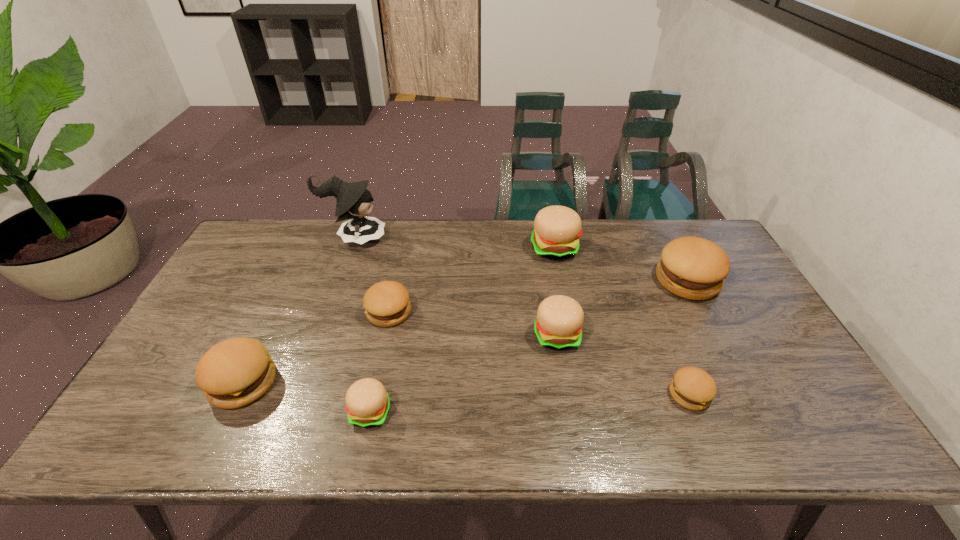
Find the location of a particular element. The height and width of the screenshot is (540, 960). the smallest brown hamburger is located at coordinates (693, 388).

Where is `vacant area situated at the face of the doll`? vacant area situated at the face of the doll is located at coordinates (436, 238).

The width and height of the screenshot is (960, 540). Find the location of `blank space located on the back of the farthest beige hamburger`. blank space located on the back of the farthest beige hamburger is located at coordinates (550, 226).

At what (x,y) coordinates should I click in order to perform the action: click on vacant area situated on the front of the biggest brown hamburger. Please return your answer as a coordinate pair (x, y). The height and width of the screenshot is (540, 960). Looking at the image, I should click on (763, 428).

I want to click on vacant region located 0.330m on the right of the second nearest beige hamburger, so click(x=700, y=335).

You are a GUI agent. You are given a task and a screenshot of the screen. Output one action in this format:
    pyautogui.click(x=<x>, y=<y>)
    Task: Click on the free space located on the back of the second biggest brown hamburger
    
    Given the screenshot: What is the action you would take?
    pyautogui.click(x=284, y=295)

This screenshot has height=540, width=960. Identify the location of blank area located 0.090m on the right of the second smallest brown hamburger. (443, 312).

The image size is (960, 540). I want to click on vacant area situated 0.150m on the back of the smallest beige hamburger, so click(384, 345).

The width and height of the screenshot is (960, 540). I want to click on free spot located 0.260m on the right of the shortest hamburger, so click(x=817, y=394).

Image resolution: width=960 pixels, height=540 pixels. What are the coordinates of `doll located in the far edge section of the desktop` in the screenshot? It's located at (354, 201).